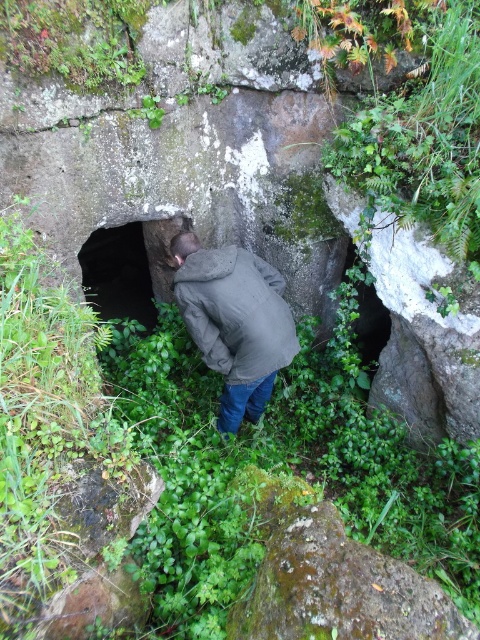
Question: From the image, what is the correct spatial relationship of dark gray cotton jacket at center in relation to dark stone cave at center?

Choices:
 (A) left
 (B) right

Answer: (B)

Question: Does dark gray cotton jacket at center have a lesser width compared to dark stone cave at center?

Choices:
 (A) yes
 (B) no

Answer: (A)

Question: Does dark gray cotton jacket at center have a smaller size compared to dark stone cave at center?

Choices:
 (A) yes
 (B) no

Answer: (A)

Question: Which point is closer to the camera taking this photo?

Choices:
 (A) (218, 275)
 (B) (117, 305)

Answer: (A)

Question: Which point is closer to the camera?

Choices:
 (A) dark stone cave at center
 (B) dark gray cotton jacket at center

Answer: (B)